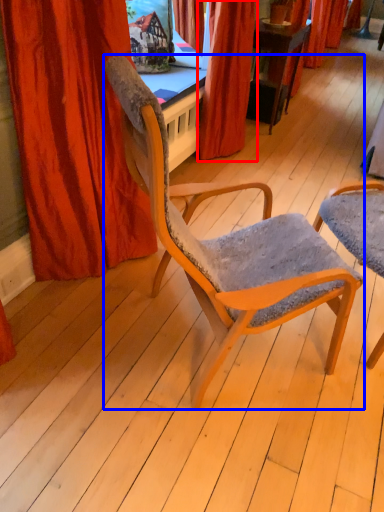
Question: Which of the following is the farthest to the observer, curtain (highlighted by a red box) or chair (highlighted by a blue box)?

Choices:
 (A) curtain
 (B) chair

Answer: (A)